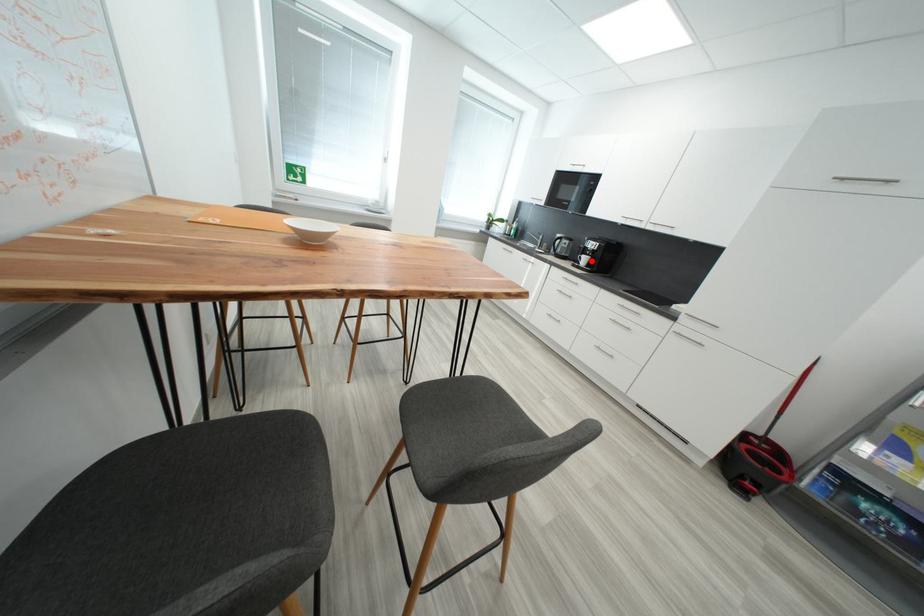
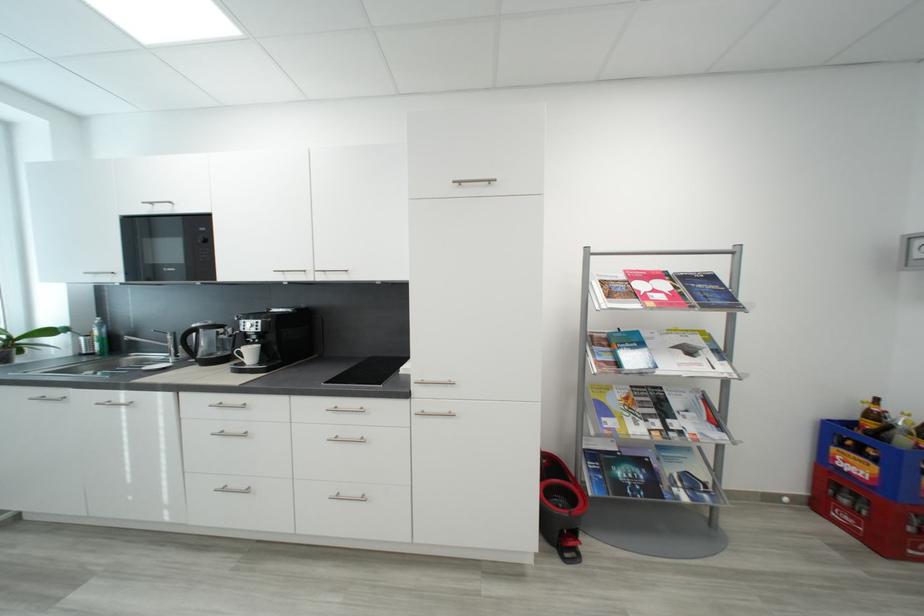
The point at the highlighted location is marked in the first image. Where is the corresponding point in the second image?

(257, 354)